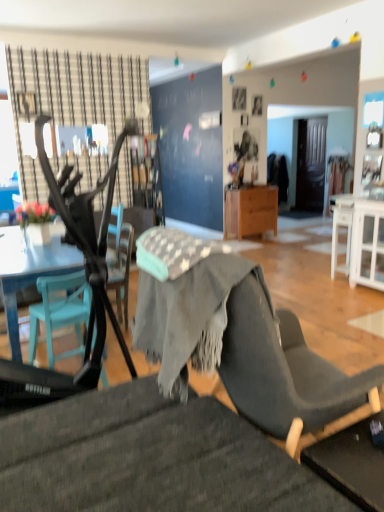
Describe the element at coordinates (149, 458) in the screenshot. I see `textured gray chair at lower center, arranged as the second chair when viewed from the back` at that location.

Measure the distance between metallic black feeding chair at left and camera.

A distance of 6.15 feet exists between metallic black feeding chair at left and camera.

Measure the distance between wooden picture frame at upper center, the 1th picture frame when ordered from left to right, and camera.

wooden picture frame at upper center, the 1th picture frame when ordered from left to right, and camera are 6.39 meters apart.

What do you see at coordinates (257, 105) in the screenshot?
I see `wooden picture frame at upper center, which is counted as the 2th picture frame, starting from the front` at bounding box center [257, 105].

What do you see at coordinates (60, 312) in the screenshot? This screenshot has width=384, height=512. I see `teal plastic chair at left, the first chair viewed from the back` at bounding box center [60, 312].

At what (x,y) coordinates should I click in order to perform the action: click on textured gray chair at lower center, arranged as the second chair when viewed from the back. Please return your answer as a coordinate pair (x, y). The height and width of the screenshot is (512, 384). Looking at the image, I should click on pos(149,458).

Can you confirm if wooden picture frame at upper center, marked as the 2th picture frame in a back-to-front arrangement, is shorter than white glossy cabinet at right?

Yes.

How much distance is there between wooden picture frame at upper center, marked as the 2th picture frame in a back-to-front arrangement, and white glossy cabinet at right?

The distance of wooden picture frame at upper center, marked as the 2th picture frame in a back-to-front arrangement, from white glossy cabinet at right is 3.13 meters.

From the image's perspective, is wooden picture frame at upper center, which is the 2th picture frame in right-to-left order, over white glossy cabinet at right?

Yes, from the image's perspective, wooden picture frame at upper center, which is the 2th picture frame in right-to-left order, is over white glossy cabinet at right.

Considering the relative sizes of metallic black feeding chair at left and teal plastic chair at left, which appears as the 2th chair when viewed from the front, in the image provided, is metallic black feeding chair at left taller than teal plastic chair at left, which appears as the 2th chair when viewed from the front,?

Indeed, metallic black feeding chair at left has a greater height compared to teal plastic chair at left, which appears as the 2th chair when viewed from the front.

Does metallic black feeding chair at left have a lesser width compared to teal plastic chair at left, which appears as the 2th chair when viewed from the front?

No, metallic black feeding chair at left is not thinner than teal plastic chair at left, which appears as the 2th chair when viewed from the front.

Is metallic black feeding chair at left far away from teal plastic chair at left, which appears as the 2th chair when viewed from the front?

No, metallic black feeding chair at left is not far away from teal plastic chair at left, which appears as the 2th chair when viewed from the front.

Can teal plastic chair at left, the first chair viewed from the back, be found inside metallic black feeding chair at left?

No, metallic black feeding chair at left does not contain teal plastic chair at left, the first chair viewed from the back.

Based on their sizes in the image, would you say teal plastic chair at left, which appears as the 2th chair when viewed from the front, is bigger or smaller than wooden picture frame at upper center, the 1th picture frame when ordered from left to right?

Clearly, teal plastic chair at left, which appears as the 2th chair when viewed from the front, is larger in size than wooden picture frame at upper center, the 1th picture frame when ordered from left to right.

Between point (79, 332) and point (240, 93), which one is positioned in front?

The point (79, 332) is in front.

How much distance is there between teal plastic chair at left, the first chair viewed from the back, and wooden picture frame at upper center, the 1th picture frame when ordered from left to right?

teal plastic chair at left, the first chair viewed from the back, and wooden picture frame at upper center, the 1th picture frame when ordered from left to right, are 4.76 meters apart.

Looking at this image, does white glossy cabinet at right lie in front of textured gray chair at lower center, which ranks as the 1th chair in front-to-back order?

No, the depth of white glossy cabinet at right is greater than that of textured gray chair at lower center, which ranks as the 1th chair in front-to-back order.

From the picture: Measure the distance between white glossy cabinet at right and textured gray chair at lower center, arranged as the second chair when viewed from the back.

white glossy cabinet at right is 3.29 meters away from textured gray chair at lower center, arranged as the second chair when viewed from the back.

Based on the photo, is textured gray chair at lower center, which ranks as the 1th chair in front-to-back order, a part of white glossy cabinet at right?

No, textured gray chair at lower center, which ranks as the 1th chair in front-to-back order, is located outside of white glossy cabinet at right.

Is white glossy cabinet at right touching textured gray chair at lower center, which ranks as the 1th chair in front-to-back order?

No.

Does wooden cabinet at center have a lesser height compared to wooden picture frame at upper center, which is the 2th picture frame in right-to-left order?

No, wooden cabinet at center is not shorter than wooden picture frame at upper center, which is the 2th picture frame in right-to-left order.

Does point (229, 209) appear closer or farther from the camera than point (245, 99)?

Point (229, 209) appears to be closer to the viewer than point (245, 99).

Who is more distant, wooden cabinet at center or wooden picture frame at upper center, which is counted as the first picture frame, starting from the front?

wooden picture frame at upper center, which is counted as the first picture frame, starting from the front, is behind.

From the picture: How many degrees apart are the facing directions of wooden cabinet at center and wooden picture frame at upper center, which is counted as the first picture frame, starting from the front?

The angular difference between wooden cabinet at center and wooden picture frame at upper center, which is counted as the first picture frame, starting from the front, is 0.873 degrees.

This screenshot has width=384, height=512. Identify the location of picture frame that is the 1st one when counting backward from the metallic black feeding chair at left. (239, 98).

From the picture: Is metallic black feeding chair at left positioned with its back to wooden picture frame at upper center, marked as the 2th picture frame in a back-to-front arrangement?

metallic black feeding chair at left is not turned away from wooden picture frame at upper center, marked as the 2th picture frame in a back-to-front arrangement.

Considering the relative sizes of metallic black feeding chair at left and wooden picture frame at upper center, marked as the 2th picture frame in a back-to-front arrangement, in the image provided, is metallic black feeding chair at left taller than wooden picture frame at upper center, marked as the 2th picture frame in a back-to-front arrangement,?

Correct, metallic black feeding chair at left is much taller as wooden picture frame at upper center, marked as the 2th picture frame in a back-to-front arrangement.

Is teal plastic chair at left, which appears as the 2th chair when viewed from the front, inside the boundaries of metallic black feeding chair at left, or outside?

teal plastic chair at left, which appears as the 2th chair when viewed from the front, is not enclosed by metallic black feeding chair at left.

Considering the relative positions of teal plastic chair at left, the first chair viewed from the back, and metallic black feeding chair at left in the image provided, is teal plastic chair at left, the first chair viewed from the back, to the left or to the right of metallic black feeding chair at left?

teal plastic chair at left, the first chair viewed from the back, is to the left of metallic black feeding chair at left.

Is point (46, 279) positioned in front of point (104, 341)?

That is False.

Between teal plastic chair at left, the first chair viewed from the back, and metallic black feeding chair at left, which one has smaller size?

teal plastic chair at left, the first chair viewed from the back.

Image resolution: width=384 pixels, height=512 pixels. I want to click on the 1st picture frame behind when counting from the white glossy cabinet at right, so click(x=239, y=98).

You are a GUI agent. You are given a task and a screenshot of the screen. Output one action in this format:
    pyautogui.click(x=<x>, y=<y>)
    Task: Click on the feeding chair above the teal plastic chair at left, which appears as the 2th chair when viewed from the front (from the image's perspective)
    This screenshot has height=512, width=384.
    Given the screenshot: What is the action you would take?
    pyautogui.click(x=90, y=249)

When comparing their distances from teal plastic chair at left, which appears as the 2th chair when viewed from the front, does white glossy cabinet at right or textured gray chair at lower center, which ranks as the 1th chair in front-to-back order, seem closer?

textured gray chair at lower center, which ranks as the 1th chair in front-to-back order.

Estimate the real-world distances between objects in this image. Which object is further from teal plastic chair at left, the first chair viewed from the back, metallic black feeding chair at left or wooden picture frame at upper center, which is the 2th picture frame in right-to-left order?

wooden picture frame at upper center, which is the 2th picture frame in right-to-left order, lies further to teal plastic chair at left, the first chair viewed from the back, than the other object.

Looking at the image, which one is located closer to teal plastic chair at left, the first chair viewed from the back, wooden picture frame at upper center, marked as the 2th picture frame in a back-to-front arrangement, or textured gray chair at lower center, which ranks as the 1th chair in front-to-back order?

Among the two, textured gray chair at lower center, which ranks as the 1th chair in front-to-back order, is located nearer to teal plastic chair at left, the first chair viewed from the back.

Based on their spatial positions, is wooden picture frame at upper center, which appears as the second picture frame when viewed from the left, or teal plastic chair at left, which appears as the 2th chair when viewed from the front, further from textured gray chair at lower center, which ranks as the 1th chair in front-to-back order?

Among the two, wooden picture frame at upper center, which appears as the second picture frame when viewed from the left, is located further to textured gray chair at lower center, which ranks as the 1th chair in front-to-back order.

Estimate the real-world distances between objects in this image. Which object is closer to white glossy cabinet at right, wooden cabinet at center or teal plastic chair at left, the first chair viewed from the back?

Based on the image, wooden cabinet at center appears to be nearer to white glossy cabinet at right.

Estimate the real-world distances between objects in this image. Which object is closer to metallic black feeding chair at left, wooden picture frame at upper center, the 1th picture frame when ordered from left to right, or white glossy cabinet at right?

The object closer to metallic black feeding chair at left is white glossy cabinet at right.

When comparing their distances from wooden picture frame at upper center, acting as the 1th picture frame starting from the back, does white glossy cabinet at right or metallic black feeding chair at left seem further?

The object further to wooden picture frame at upper center, acting as the 1th picture frame starting from the back, is metallic black feeding chair at left.

Looking at the image, which one is located further to wooden picture frame at upper center, which is counted as the first picture frame, starting from the front, white glossy cabinet at right or textured gray chair at lower center, arranged as the second chair when viewed from the back?

textured gray chair at lower center, arranged as the second chair when viewed from the back, lies further to wooden picture frame at upper center, which is counted as the first picture frame, starting from the front, than the other object.

The height and width of the screenshot is (512, 384). I want to click on table between white glossy cabinet at right and wooden picture frame at upper center, which is counted as the 2th picture frame, starting from the front, from front to back, so click(x=250, y=211).

Where is `cabinetry located between teal plastic chair at left, the first chair viewed from the back, and wooden picture frame at upper center, acting as the 1th picture frame starting from the back, in the depth direction`? cabinetry located between teal plastic chair at left, the first chair viewed from the back, and wooden picture frame at upper center, acting as the 1th picture frame starting from the back, in the depth direction is located at coordinates (367, 244).

At what (x,y) coordinates should I click in order to perform the action: click on chair between textured gray chair at lower center, arranged as the second chair when viewed from the back, and wooden picture frame at upper center, which is counted as the first picture frame, starting from the front, along the z-axis. Please return your answer as a coordinate pair (x, y). Looking at the image, I should click on (60, 312).

Find the location of a particular element. This screenshot has height=512, width=384. chair located between textured gray chair at lower center, arranged as the second chair when viewed from the back, and wooden picture frame at upper center, the 1th picture frame from the right, in the depth direction is located at coordinates (60, 312).